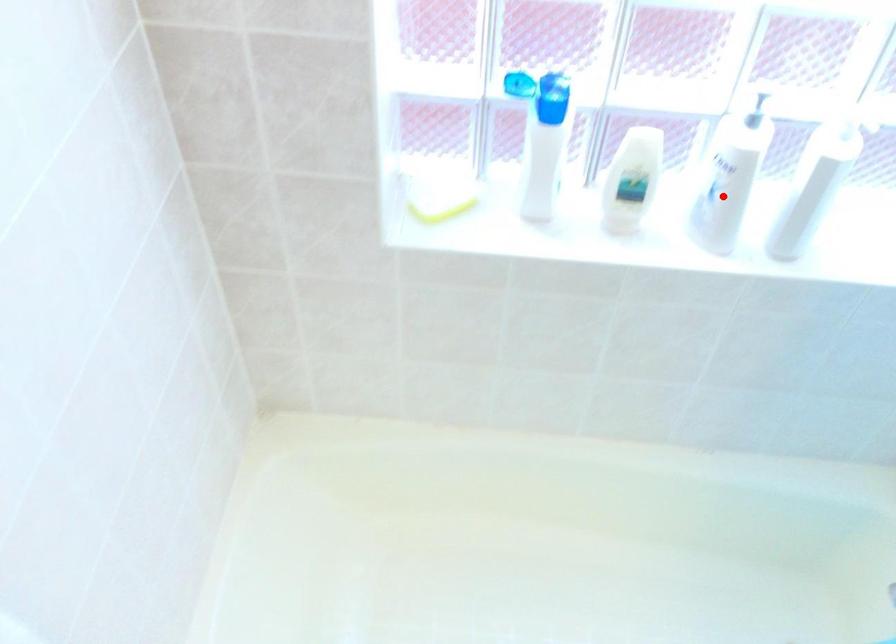
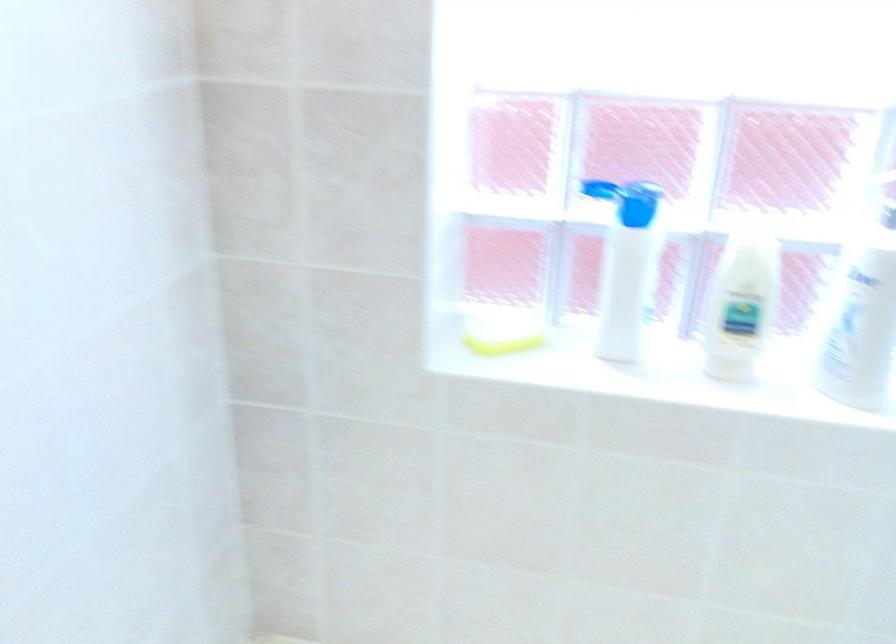
Question: A red point is marked in image1. In image2, is the corresponding 3D point closer to the camera or farther? Reply with the corresponding letter.

Choices:
 (A) The corresponding 3D point is closer.
 (B) The corresponding 3D point is farther.

Answer: (A)